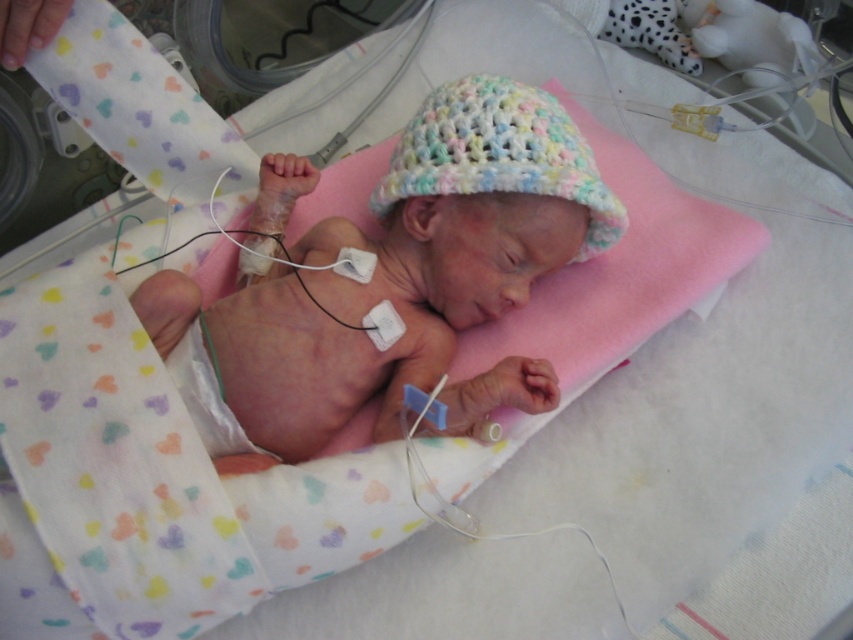
Does pastel crocheted hat at center have a larger size compared to pastel crochet hat at center?

Indeed, pastel crocheted hat at center has a larger size compared to pastel crochet hat at center.

Consider the image. Does pastel crocheted hat at center have a greater height compared to pastel crochet hat at center?

Correct, pastel crocheted hat at center is much taller as pastel crochet hat at center.

Which is behind, point (230, 314) or point (544, 163)?

Point (230, 314)

This screenshot has width=853, height=640. What are the coordinates of `pastel crocheted hat at center` in the screenshot? It's located at (399, 268).